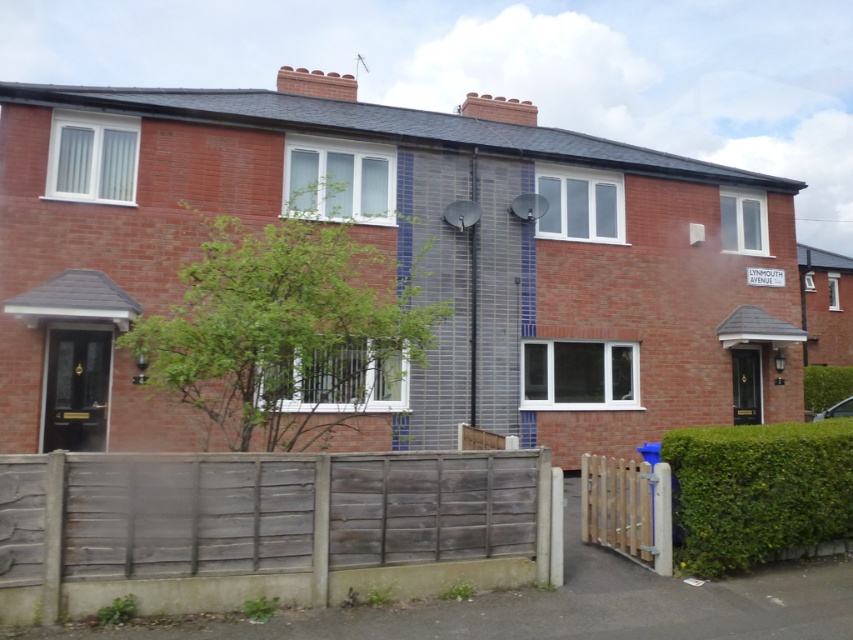
Question: From the image, what is the correct spatial relationship of green leafy hedge at lower right in relation to wooden picket gate at lower right?

Choices:
 (A) below
 (B) above

Answer: (B)

Question: Considering the relative positions of weathered wood fence at lower center and wooden picket gate at lower right in the image provided, where is weathered wood fence at lower center located with respect to wooden picket gate at lower right?

Choices:
 (A) left
 (B) right

Answer: (A)

Question: Which of the following is the farthest from the observer?

Choices:
 (A) (801, 442)
 (B) (639, 552)
 (C) (215, 532)

Answer: (B)

Question: Among these points, which one is farthest from the camera?

Choices:
 (A) (315, 538)
 (B) (825, 481)

Answer: (B)

Question: Which point is closer to the camera?

Choices:
 (A) wooden picket gate at lower right
 (B) weathered wood fence at lower center
 (C) green leafy hedge at lower right

Answer: (B)

Question: Does weathered wood fence at lower center appear over wooden picket gate at lower right?

Choices:
 (A) no
 (B) yes

Answer: (B)